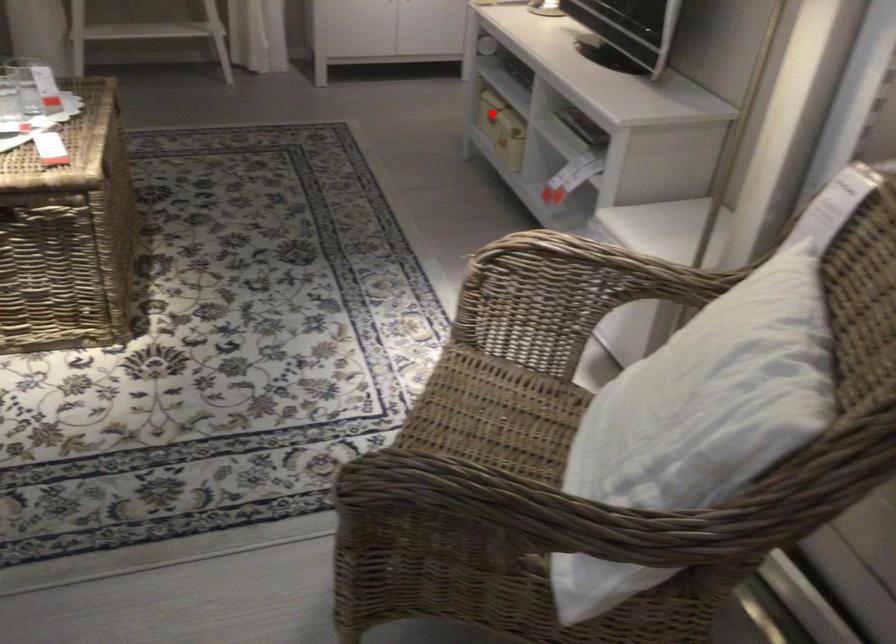
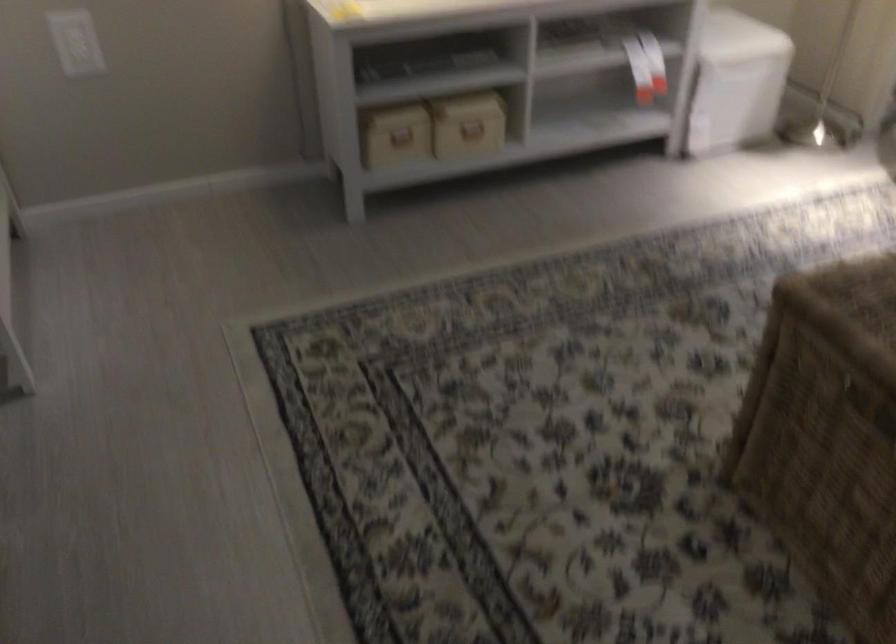
Question: I am providing you with two images of the same scene from different viewpoints. Image1 has a red point marked. In image2, the corresponding 3D location appears at what relative position? Reply with the corresponding letter.

Choices:
 (A) Closer
 (B) Farther

Answer: (A)